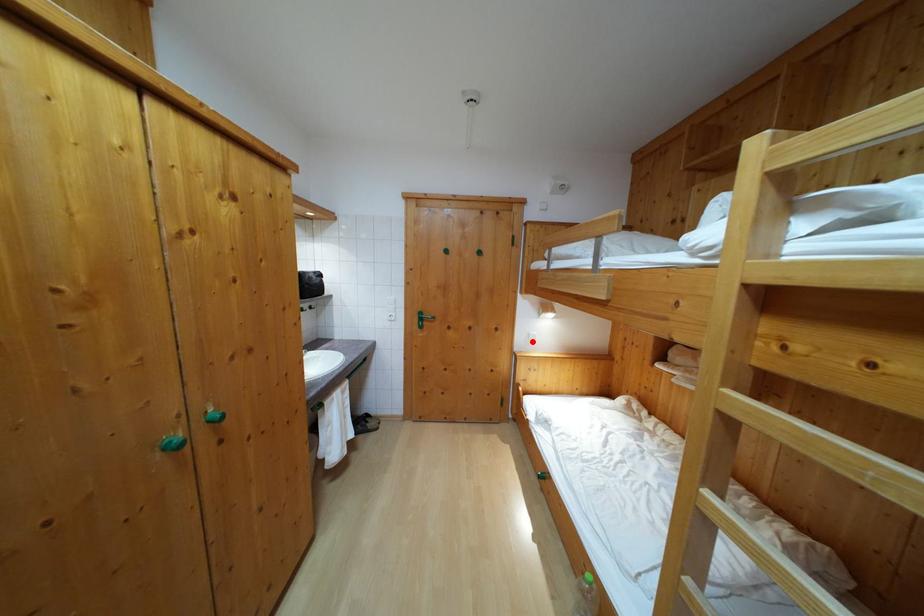
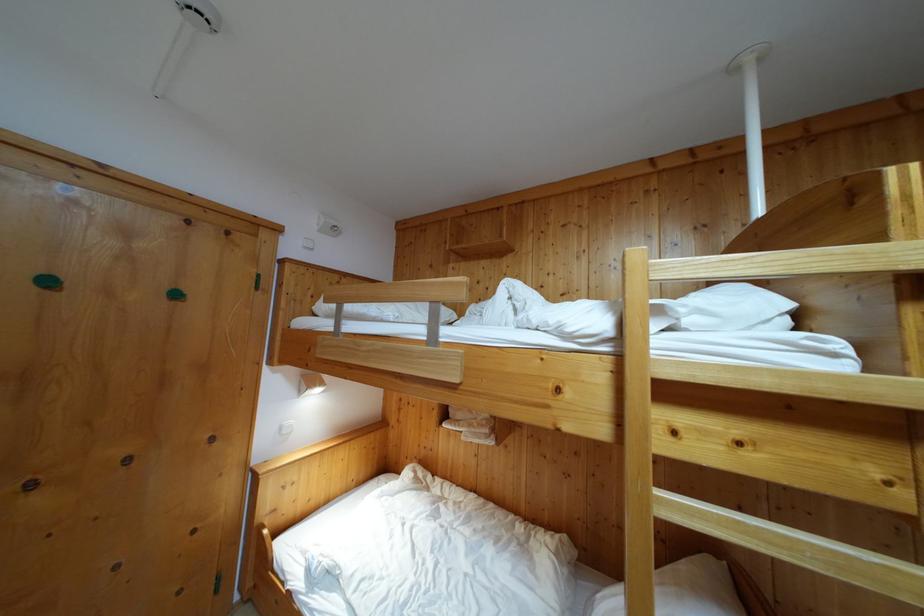
In the second image, find the point that corresponds to the highlighted location in the first image.

(285, 435)